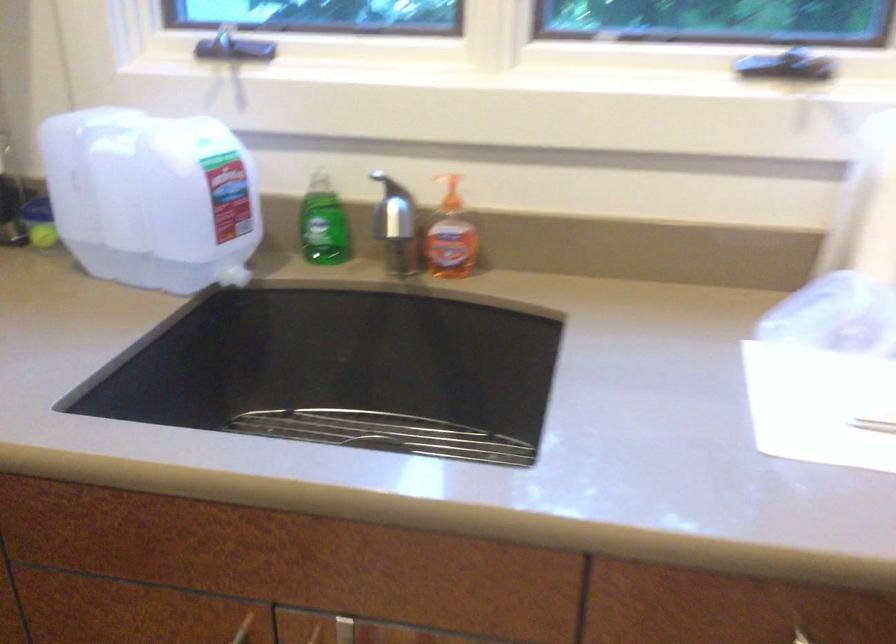
This screenshot has width=896, height=644. Describe the element at coordinates (451, 236) in the screenshot. I see `the orange soap pump` at that location.